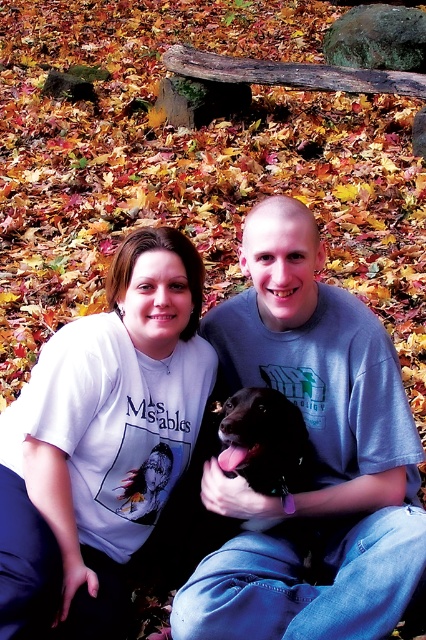
Based on the coordinates provided, can you identify which object is located at point (316, 451) in the scene?

The point (316, 451) corresponds to the white cotton shirt at center.

You are standing at the origin point in the image. You want to reach the point that is closer to the black dog with a pink collar. Which point should you go to first, point (x=383, y=448) or point (x=187, y=412)?

Point (x=187, y=412) is closer to the black dog with a pink collar, so you should go to point (x=187, y=412) first.